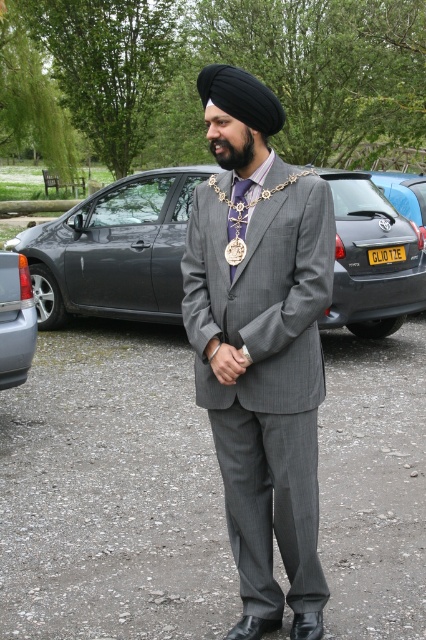
From the picture: You are a photographer trying to capture a photo of the man in the gray pinstripe suit. You want to ensure that both the point at (374, 289) and the point at (5, 349) are visible in the frame. Which point should be placed closer to the camera to avoid obstruction?

Point (5, 349) should be placed closer to the camera because point (374, 289) is behind point (5, 349), so positioning the closer point nearer to the camera ensures both are visible without obstruction.

You are a photographer trying to capture a clear photo of the gray metallic car at center and the black fuzzy beard at center. Since the camera can only focus on one subject at a time, which subject should you focus on to ensure the details of both are visible in the final photo?

The gray metallic car at center is larger than the black fuzzy beard at center, so focusing on the gray metallic car at center will ensure both subjects are in focus as the larger subject will have more details visible even if the beard is slightly out of focus.

Based on the photo, you are trying to locate the blue metallic car at center in the parking area. According to the coordinates provided, where exactly is it positioned?

The blue metallic car at center is located at point (403, 193), which means it is positioned near the lower right area of the parking lot.